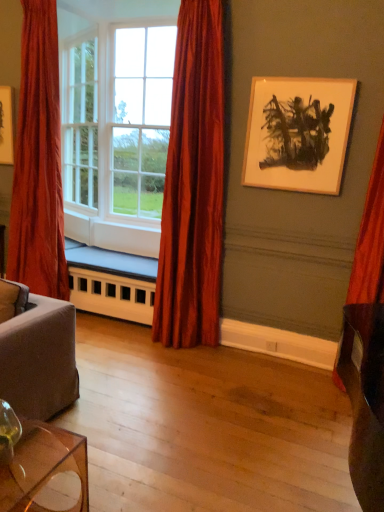
Question: From the image's perspective, is white glass window at center located above or below white painted wood radiator at lower center?

Choices:
 (A) above
 (B) below

Answer: (A)

Question: Based on their sizes in the image, would you say white glass window at center is bigger or smaller than white painted wood radiator at lower center?

Choices:
 (A) big
 (B) small

Answer: (A)

Question: Based on their relative distances, which object is nearer to the white painted wood radiator at lower center?

Choices:
 (A) silky red curtain at center, which ranks as the 2th curtain in left-to-right order
 (B) velvet red curtain at left, placed as the third curtain when sorted from right to left
 (C) transparent glass table at lower left
 (D) velvet red curtain at right, placed as the first curtain when sorted from right to left
 (E) wooden picture frame at upper right

Answer: (B)

Question: Which of these objects is positioned closest to the transparent glass table at lower left?

Choices:
 (A) velvet red curtain at right, placed as the first curtain when sorted from right to left
 (B) wooden picture frame at upper right
 (C) white glass window at center
 (D) silky red curtain at center, which appears as the 2th curtain when viewed from the right
 (E) velvet red curtain at left, placed as the third curtain when sorted from right to left

Answer: (D)